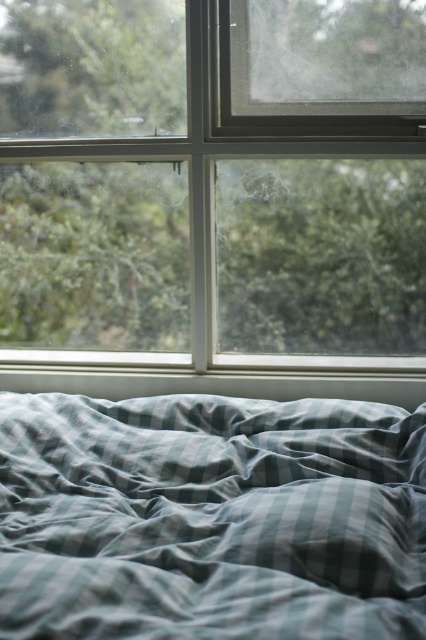
You are trying to decide whether to place a large potted plant between the clear glass window at upper center and the green striped fabric at lower center. Given their sizes, which object should the plant be placed closer to for balance?

The clear glass window at upper center is larger in size than the green striped fabric at lower center, so the plant should be placed closer to the green striped fabric at lower center to balance the composition.

You are standing in the room and want to check the view outside the clear glass window at upper center. To do so, you need to move away from the green striped fabric at lower center. In which direction should you move?

Since the clear glass window at upper center is positioned on the left side of the green striped fabric at lower center, you should move to the left to get away from the green striped fabric at lower center and towards the window.